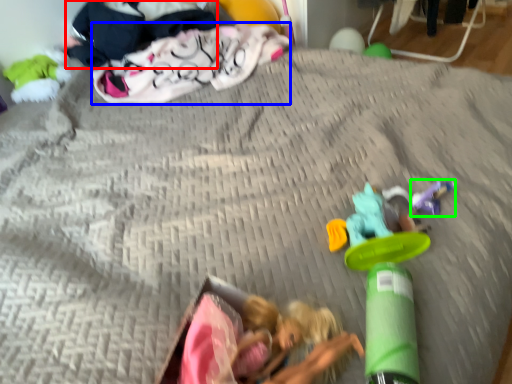
Question: Which is farther away from clothing (highlighted by a red box)? clothing (highlighted by a blue box) or toy (highlighted by a green box)?

Choices:
 (A) clothing
 (B) toy

Answer: (B)